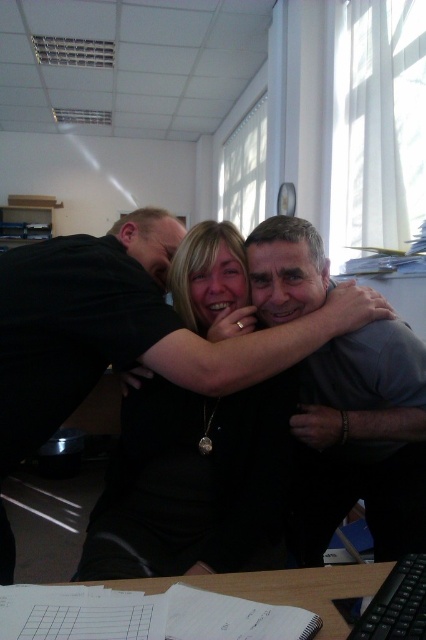
Question: Among these points, which one is nearest to the camera?

Choices:
 (A) (400, 618)
 (B) (163, 481)
 (C) (414, 497)
 (D) (302, 609)

Answer: (A)

Question: Can you confirm if gray smooth shirt at center is thinner than wooden table at lower center?

Choices:
 (A) no
 (B) yes

Answer: (B)

Question: Where is black matte shirt at center located in relation to wooden table at lower center in the image?

Choices:
 (A) right
 (B) left

Answer: (B)

Question: Among these objects, which one is nearest to the camera?

Choices:
 (A) black plastic keyboard at lower right
 (B) black matte shirt at center
 (C) gray smooth shirt at center
 (D) wooden table at lower center

Answer: (A)

Question: Which object is closer to the camera taking this photo?

Choices:
 (A) wooden table at lower center
 (B) gray smooth shirt at center

Answer: (A)

Question: Does black matte shirt at center have a greater width compared to wooden table at lower center?

Choices:
 (A) no
 (B) yes

Answer: (B)